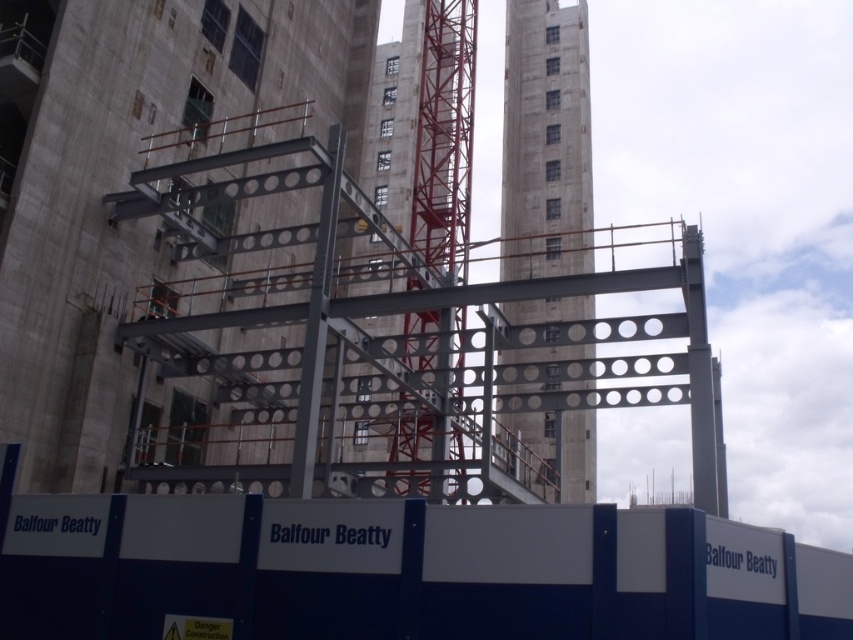
Does metallic gray steel frame at center have a lesser height compared to concrete tower at center?

Yes, metallic gray steel frame at center is shorter than concrete tower at center.

Is point (54, 227) more distant than point (566, 148)?

No, (54, 227) is in front of (566, 148).

Where is `metallic gray steel frame at center`? The height and width of the screenshot is (640, 853). metallic gray steel frame at center is located at coordinates (125, 182).

Is concrete tower at center positioned behind red metal crane at center?

That is False.

Is concrete tower at center bigger than red metal crane at center?

→ Indeed, concrete tower at center has a larger size compared to red metal crane at center.

Which is in front, point (577, 177) or point (418, 250)?

Point (418, 250) is in front.

Find the location of a particular element. concrete tower at center is located at coordinates (544, 141).

Find the location of a particular element. Image resolution: width=853 pixels, height=640 pixels. metallic gray steel frame at center is located at coordinates (125, 182).

Is metallic gray steel frame at center smaller than red metal crane at center?

Indeed, metallic gray steel frame at center has a smaller size compared to red metal crane at center.

Which is in front, point (112, 179) or point (401, 412)?

Positioned in front is point (112, 179).

The width and height of the screenshot is (853, 640). I want to click on metallic gray steel frame at center, so coord(125,182).